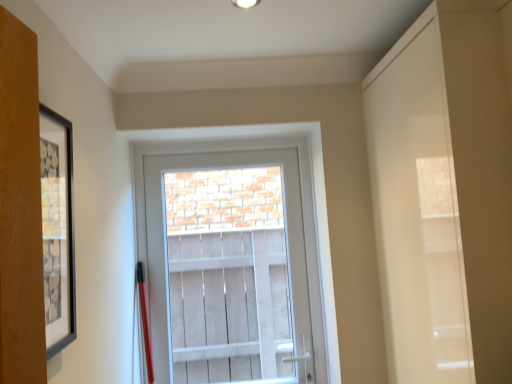
Question: Does clear glass door at center have a smaller size compared to white glossy door at right?

Choices:
 (A) yes
 (B) no

Answer: (A)

Question: From the image's perspective, is clear glass door at center below white glossy door at right?

Choices:
 (A) yes
 (B) no

Answer: (A)

Question: Would you say clear glass door at center contains white glossy door at right?

Choices:
 (A) yes
 (B) no

Answer: (B)

Question: Considering the relative sizes of clear glass door at center and white glossy door at right in the image provided, is clear glass door at center wider than white glossy door at right?

Choices:
 (A) no
 (B) yes

Answer: (A)

Question: From a real-world perspective, is clear glass door at center positioned under white glossy door at right based on gravity?

Choices:
 (A) no
 (B) yes

Answer: (B)

Question: Does clear glass door at center turn towards white glossy door at right?

Choices:
 (A) yes
 (B) no

Answer: (B)

Question: Is the depth of white glossy door at right less than that of black matte picture frame at left?

Choices:
 (A) yes
 (B) no

Answer: (B)

Question: Can you confirm if white glossy door at right is thinner than black matte picture frame at left?

Choices:
 (A) no
 (B) yes

Answer: (A)

Question: From a real-world perspective, is white glossy door at right located beneath black matte picture frame at left?

Choices:
 (A) no
 (B) yes

Answer: (B)

Question: Is white glossy door at right at the left side of black matte picture frame at left?

Choices:
 (A) yes
 (B) no

Answer: (B)

Question: From a real-world perspective, does white glossy door at right stand above black matte picture frame at left?

Choices:
 (A) yes
 (B) no

Answer: (B)

Question: Is white glossy door at right oriented away from black matte picture frame at left?

Choices:
 (A) no
 (B) yes

Answer: (A)

Question: Does black matte picture frame at left appear on the right side of white glossy door at right?

Choices:
 (A) yes
 (B) no

Answer: (B)